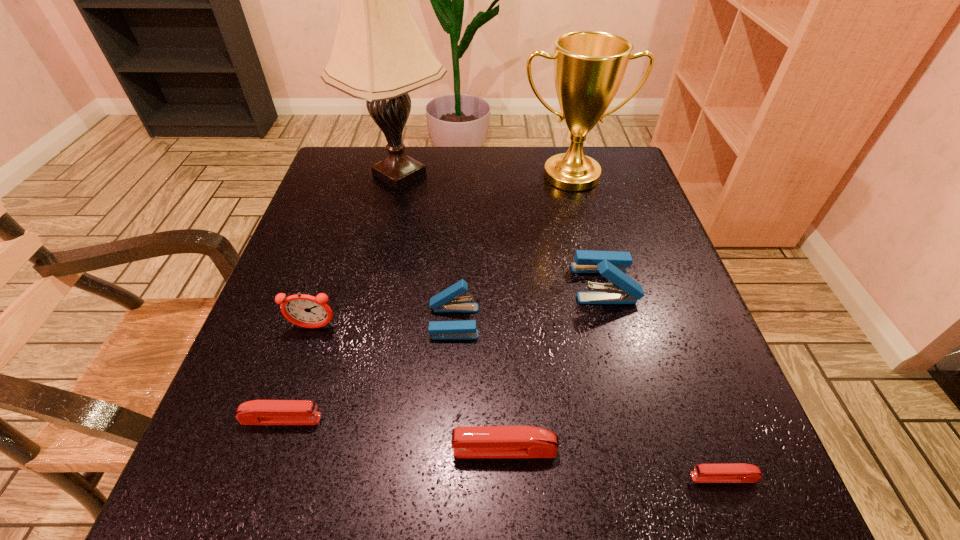
The image size is (960, 540). I want to click on vacant space located 0.220m on the front-facing side of the second farthest red stapler, so click(302, 450).

Find the location of `free spot located 0.190m on the front-facing side of the second farthest red stapler`. free spot located 0.190m on the front-facing side of the second farthest red stapler is located at coordinates (324, 450).

Find the location of a particular element. vacant position located 0.200m on the front-facing side of the second farthest red stapler is located at coordinates (317, 450).

Where is `free space located 0.110m on the front-facing side of the leftmost red stapler`? The height and width of the screenshot is (540, 960). free space located 0.110m on the front-facing side of the leftmost red stapler is located at coordinates (392, 419).

Where is `free space located on the front-facing side of the rightmost red stapler`? free space located on the front-facing side of the rightmost red stapler is located at coordinates (513, 477).

Locate an element on the screen. vacant space located on the front-facing side of the rightmost red stapler is located at coordinates (484, 477).

At what (x,y) coordinates should I click in order to perform the action: click on vacant space located 0.180m on the front-facing side of the rightmost red stapler. Please return your answer as a coordinate pair (x, y). Looking at the image, I should click on (563, 477).

The image size is (960, 540). I want to click on lamp at the far edge, so pyautogui.click(x=379, y=54).

The image size is (960, 540). I want to click on award that is positioned at the far edge, so 589,66.

Identify the location of lamp present at the left edge. (379, 54).